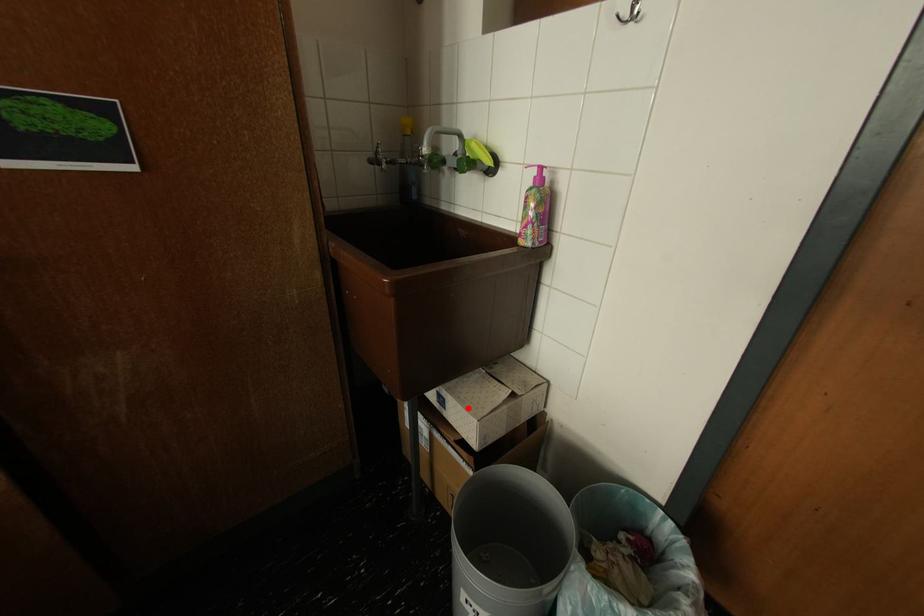
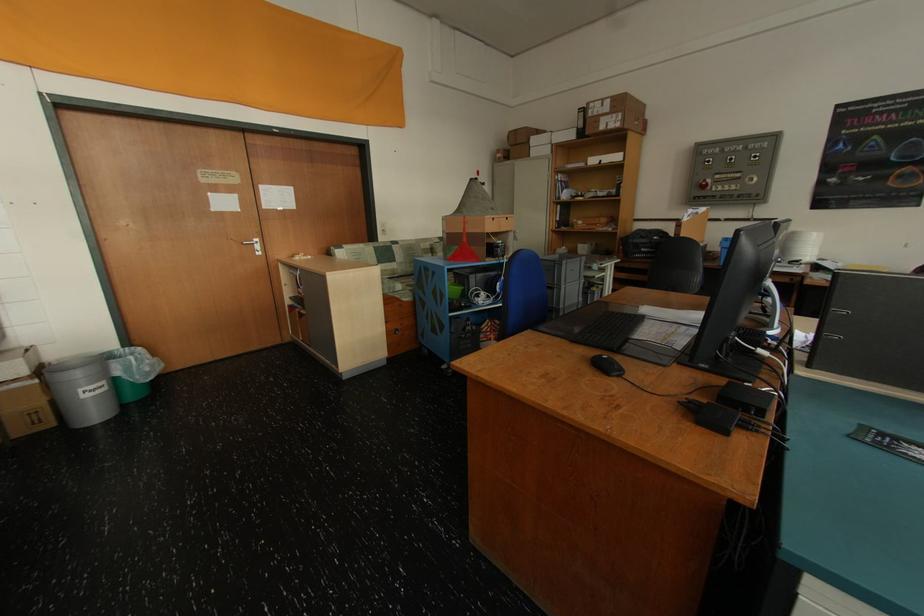
Question: I am providing you with two images of the same scene from different viewpoints. A red point is marked on the first image. At the location where the point appears in image 1, is it still visible in image 2?

Choices:
 (A) Yes
 (B) No

Answer: (A)